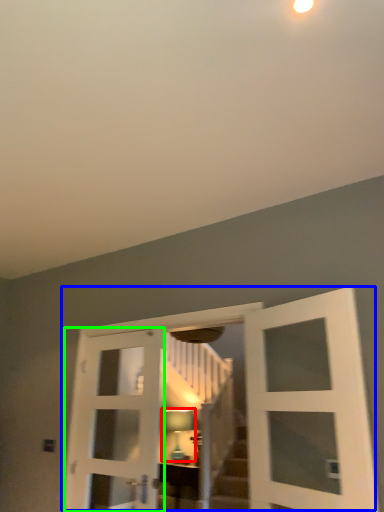
Question: Which object is the farthest from light fixture (highlighted by a red box)? Choose among these: door (highlighted by a blue box) or door (highlighted by a green box).

Choices:
 (A) door
 (B) door

Answer: (A)